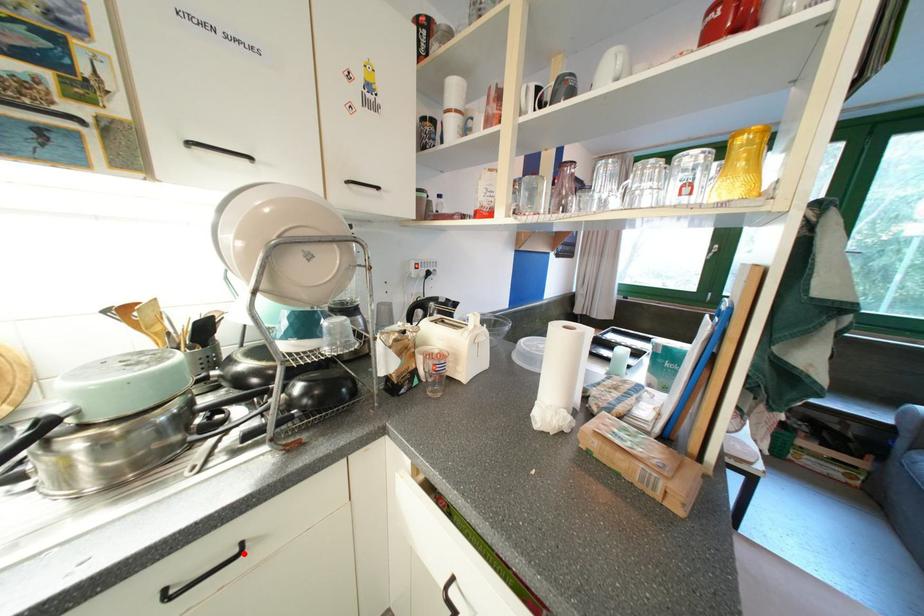
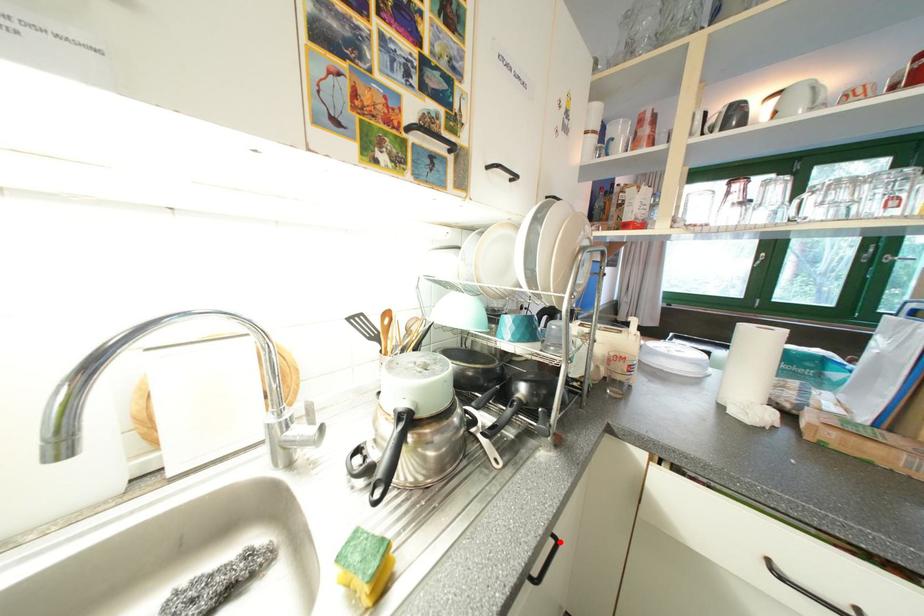
I am providing you with two images of the same scene from different viewpoints. A red point is marked on the first image and another point is marked on the second image. Does the point marked in image1 correspond to the same location as the one in image2?

Yes